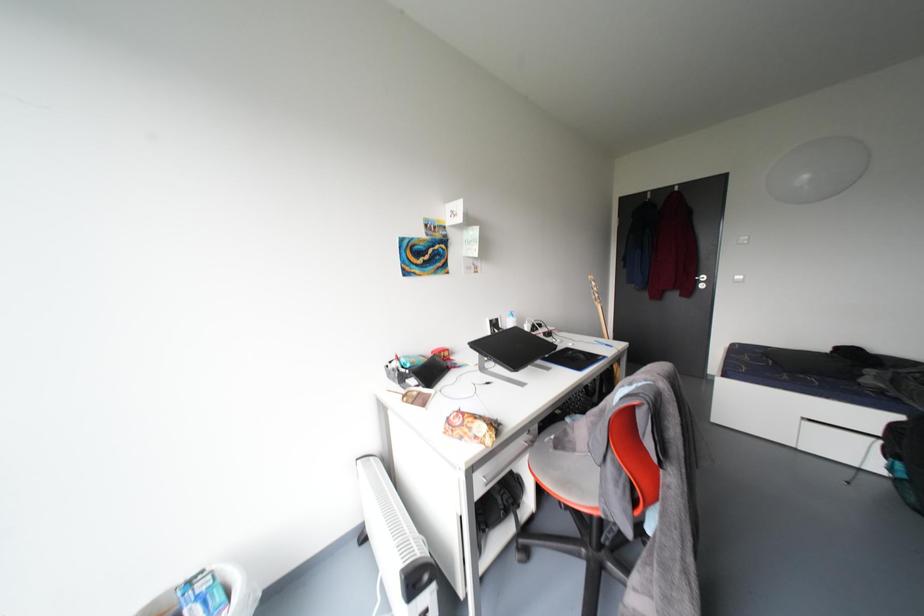
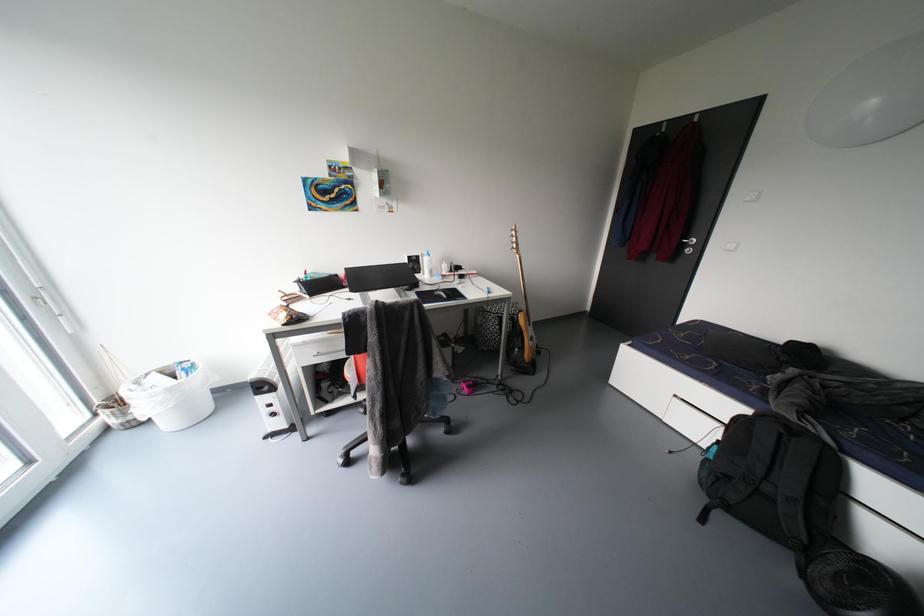
Question: Which direction would the cameraman need to move to produce the second image? Reply with the corresponding letter.

Choices:
 (A) Left
 (B) Right
 (C) Forward
 (D) Backward

Answer: (B)